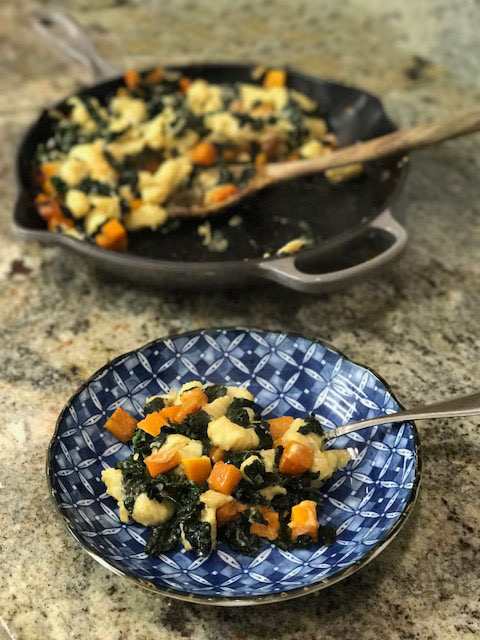
At what (x,y) coordinates should I click in order to perform the action: click on silver fork. Please return your answer as a coordinate pair (x, y). The image size is (480, 640). Looking at the image, I should click on (355, 427).